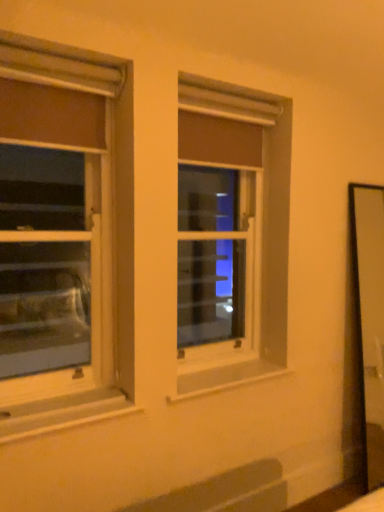
Question: Is clear glass window at center, marked as the 1th window in a back-to-front arrangement, inside or outside of matte white window at left, the 1th window from the front?

Choices:
 (A) outside
 (B) inside

Answer: (A)

Question: In terms of height, does clear glass window at center, positioned as the 1th window in right-to-left order, look taller or shorter compared to matte white window at left, which is the 1th window from left to right?

Choices:
 (A) tall
 (B) short

Answer: (A)

Question: Which is nearer to the white painted wood at lower left?

Choices:
 (A) clear glass window at center, marked as the 1th window in a back-to-front arrangement
 (B) matte white window at left, which is the 2th window in back-to-front order

Answer: (A)

Question: Which object is positioned farthest from the matte white window at left, the 1th window from the front?

Choices:
 (A) clear glass window at center, arranged as the second window when viewed from the left
 (B) white painted wood at lower left

Answer: (B)